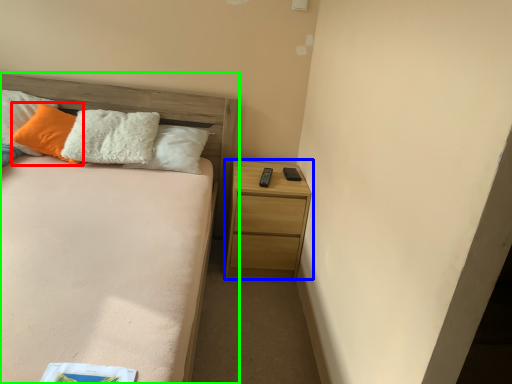
Question: Which object is the closest to the pillow (highlighted by a red box)? Choose among these: nightstand (highlighted by a blue box) or bed (highlighted by a green box).

Choices:
 (A) nightstand
 (B) bed

Answer: (B)